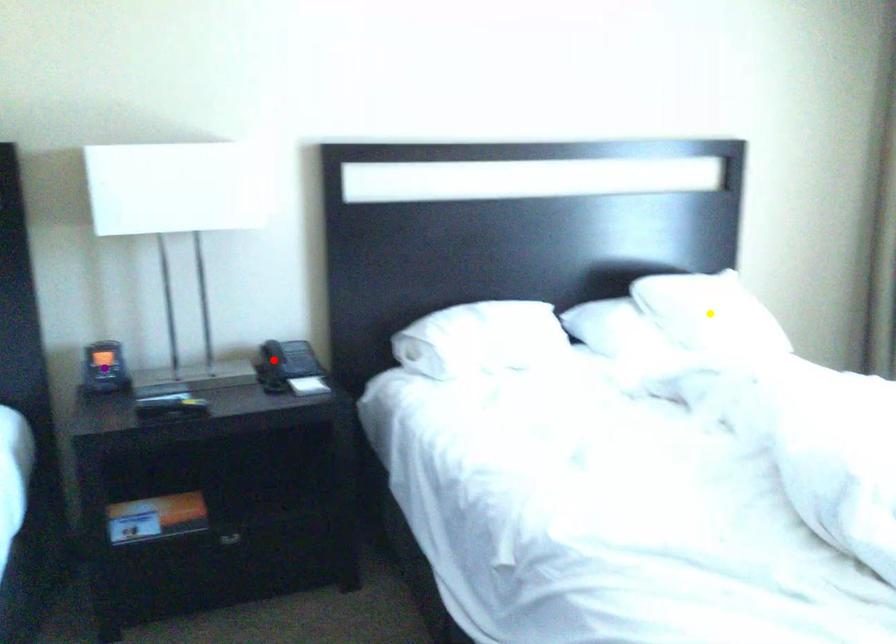
Order these from nearest to farthest:
yellow point | purple point | red point

1. yellow point
2. red point
3. purple point